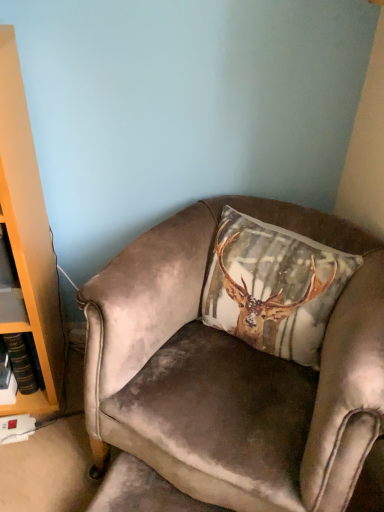
Question: Is the position of velvet beige pillow with deer print at center less distant than that of velvet brown armchair at center?

Choices:
 (A) no
 (B) yes

Answer: (A)

Question: Considering the relative sizes of velvet beige pillow with deer print at center and velvet brown armchair at center in the image provided, is velvet beige pillow with deer print at center bigger than velvet brown armchair at center?

Choices:
 (A) yes
 (B) no

Answer: (B)

Question: Can you confirm if velvet beige pillow with deer print at center is shorter than velvet brown armchair at center?

Choices:
 (A) no
 (B) yes

Answer: (B)

Question: From a real-world perspective, is velvet beige pillow with deer print at center positioned under velvet brown armchair at center based on gravity?

Choices:
 (A) no
 (B) yes

Answer: (A)

Question: From the image's perspective, would you say velvet beige pillow with deer print at center is shown under velvet brown armchair at center?

Choices:
 (A) yes
 (B) no

Answer: (B)

Question: Could you tell me if velvet beige pillow with deer print at center is facing velvet brown armchair at center?

Choices:
 (A) no
 (B) yes

Answer: (B)

Question: Does velvet brown armchair at center have a smaller size compared to velvet beige pillow with deer print at center?

Choices:
 (A) yes
 (B) no

Answer: (B)

Question: Considering the relative sizes of velvet brown armchair at center and velvet beige pillow with deer print at center in the image provided, is velvet brown armchair at center wider than velvet beige pillow with deer print at center?

Choices:
 (A) no
 (B) yes

Answer: (B)

Question: Is velvet brown armchair at center aimed at velvet beige pillow with deer print at center?

Choices:
 (A) yes
 (B) no

Answer: (B)

Question: Is velvet brown armchair at center thinner than velvet beige pillow with deer print at center?

Choices:
 (A) no
 (B) yes

Answer: (A)

Question: Is velvet brown armchair at center positioned far away from velvet beige pillow with deer print at center?

Choices:
 (A) no
 (B) yes

Answer: (A)

Question: Is the position of velvet brown armchair at center more distant than that of velvet beige pillow with deer print at center?

Choices:
 (A) no
 (B) yes

Answer: (A)

Question: Is velvet beige pillow with deer print at center situated inside velvet brown armchair at center or outside?

Choices:
 (A) outside
 (B) inside

Answer: (B)